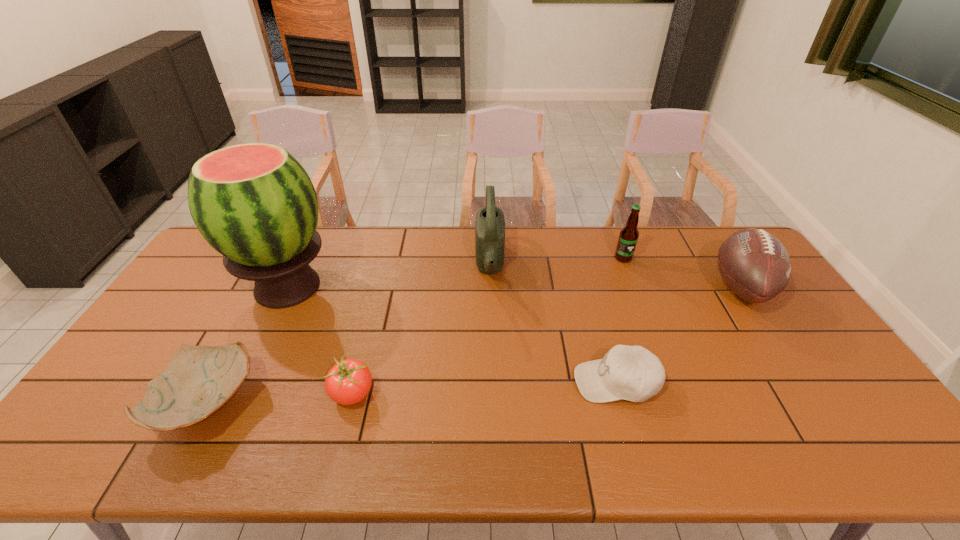
Locate an element on the screen. This screenshot has height=540, width=960. free location that satisfies the following two spatial constraints: 1. on the label of the sixth object from left to right; 2. on the front-facing side of the baseball cap is located at coordinates (672, 382).